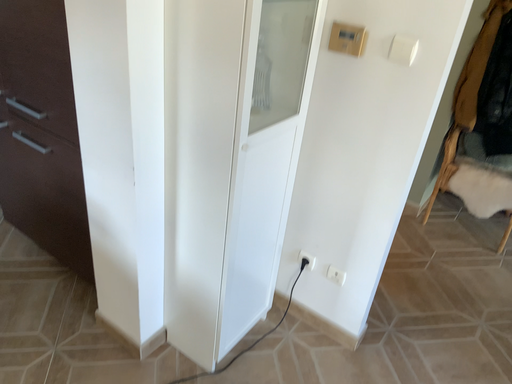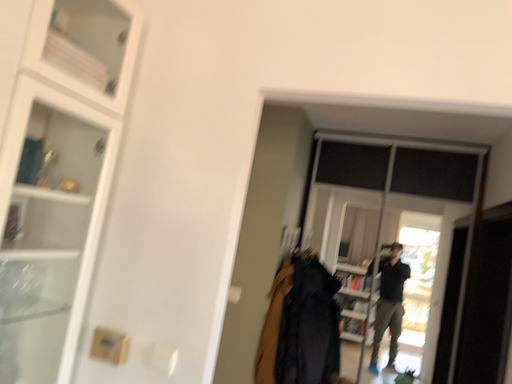
Question: Which way did the camera rotate in the video?

Choices:
 (A) rotated right
 (B) rotated left

Answer: (A)